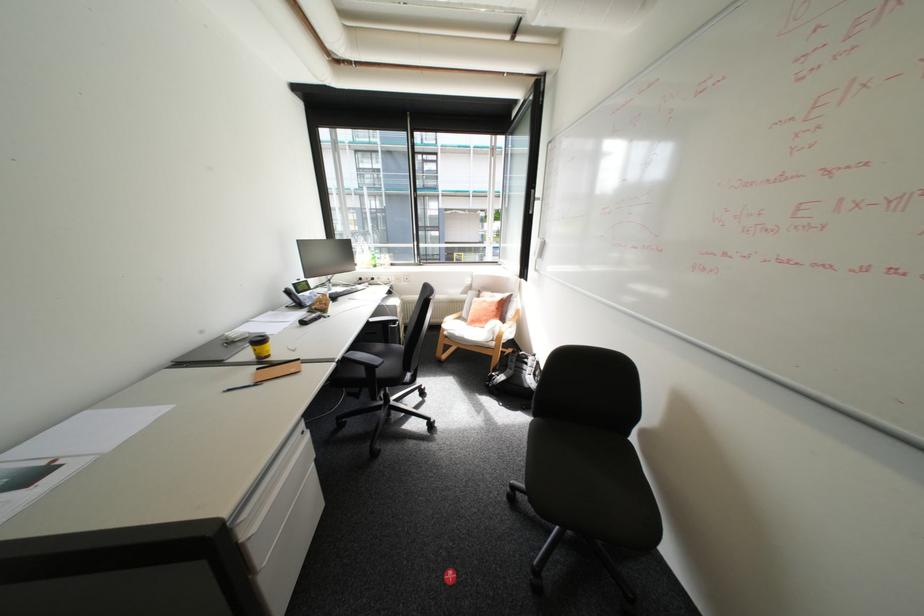
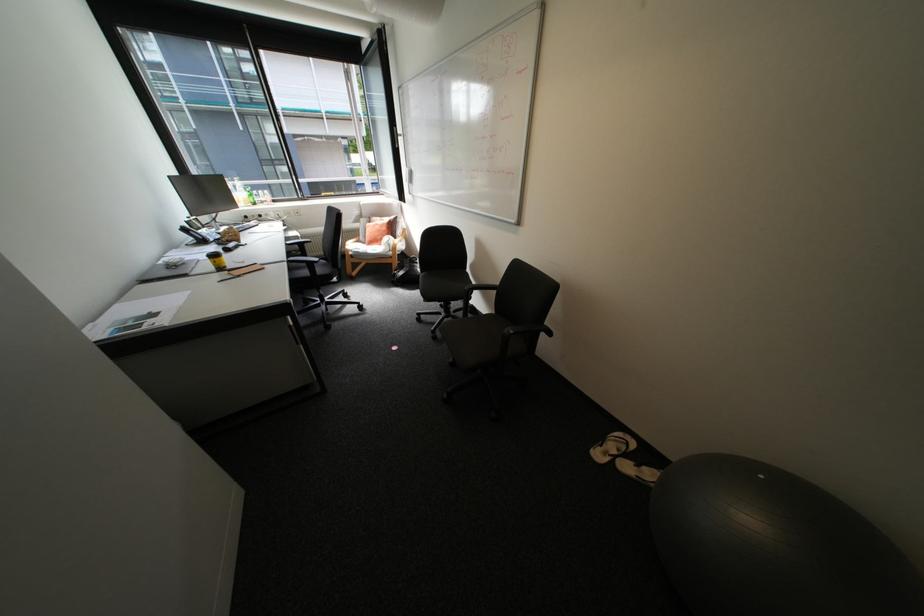
Question: I am providing you with two images of the same scene from different viewpoints. Please identify which objects are invisible in image2.

Choices:
 (A) yellow travel mug
 (B) gray exercise ball
 (C) chair sitting surface
 (D) none of these

Answer: (D)